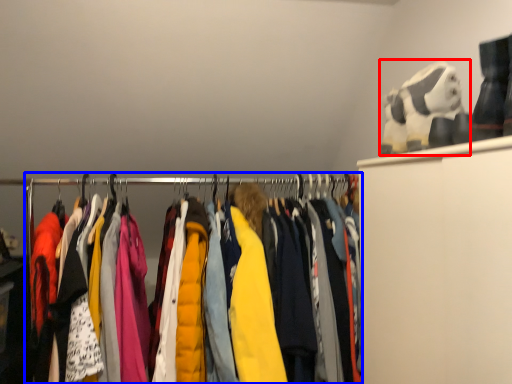
Question: Which object is closer to the camera taking this photo, toy (highlighted by a red box) or closet (highlighted by a blue box)?

Choices:
 (A) toy
 (B) closet

Answer: (B)